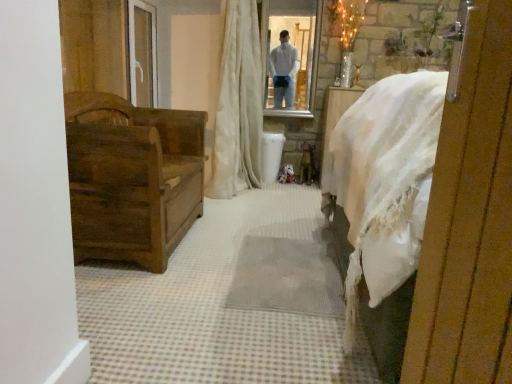
This screenshot has height=384, width=512. What do you see at coordinates (238, 105) in the screenshot?
I see `white textured curtain at center` at bounding box center [238, 105].

This screenshot has width=512, height=384. What are the coordinates of `dark brown wood chest at left` in the screenshot? It's located at (132, 178).

The width and height of the screenshot is (512, 384). Describe the element at coordinates (228, 302) in the screenshot. I see `wooden chest at left` at that location.

The height and width of the screenshot is (384, 512). Find the location of `white textured curtain at center`. white textured curtain at center is located at coordinates (238, 105).

Considering the relative sizes of white textured curtain at center and wooden chest at left in the image provided, is white textured curtain at center taller than wooden chest at left?

Yes.

From the image's perspective, relative to wooden chest at left, is white textured curtain at center above or below?

Clearly, from the image's perspective, white textured curtain at center is above wooden chest at left.

Visually, is white textured curtain at center positioned to the left or to the right of wooden chest at left?

From the image, it's evident that white textured curtain at center is to the right of wooden chest at left.

Could you tell me if white textured curtain at center is turned towards wooden chest at left?

No, white textured curtain at center is not facing towards wooden chest at left.

Which object is positioned more to the left, wooden chest at left or white textured curtain at center?

wooden chest at left is more to the left.

Are wooden chest at left and white textured curtain at center located far from each other?

That's right, there is a large distance between wooden chest at left and white textured curtain at center.

Between point (156, 371) and point (223, 100), which one is positioned in front?

The point (156, 371) is in front.

From a real-world perspective, is wooden chest at left on white textured curtain at center?

No, from a real-world perspective, wooden chest at left is not above white textured curtain at center.

How different are the orientations of clear glass mirror at upper center and wooden chest at left in degrees?

The angle between the facing direction of clear glass mirror at upper center and the facing direction of wooden chest at left is 91.7 degrees.

Measure the distance from clear glass mirror at upper center to wooden chest at left.

clear glass mirror at upper center is 7.01 feet away from wooden chest at left.

Find the location of a particular element. plain beneath the clear glass mirror at upper center (from a real-world perspective) is located at coordinates (228, 302).

Between clear glass mirror at upper center and wooden chest at left, which one has larger width?

Wider between the two is wooden chest at left.

What are the coordinates of `mirror lying above the white textured curtain at center (from the image's perspective)` in the screenshot? It's located at (292, 55).

From the image's perspective, is clear glass mirror at upper center on top of white textured curtain at center?

Yes, from the image's perspective, clear glass mirror at upper center is over white textured curtain at center.

From their relative heights in the image, would you say clear glass mirror at upper center is taller or shorter than white textured curtain at center?

In the image, clear glass mirror at upper center appears to be shorter than white textured curtain at center.

At what (x,y) coordinates should I click in order to perform the action: click on curtain located behind the dark brown wood chest at left. Please return your answer as a coordinate pair (x, y). The image size is (512, 384). Looking at the image, I should click on (238, 105).

Is white textured curtain at center oriented towards dark brown wood chest at left?

No, white textured curtain at center is not oriented towards dark brown wood chest at left.

From the image's perspective, which one is positioned higher, white textured curtain at center or dark brown wood chest at left?

white textured curtain at center is shown above in the image.

Looking at their sizes, would you say dark brown wood chest at left is wider or thinner than white textured curtain at center?

Clearly, dark brown wood chest at left has more width compared to white textured curtain at center.

How different are the orientations of dark brown wood chest at left and white textured curtain at center in degrees?

They differ by 2.26 degrees in their facing directions.

Is the surface of dark brown wood chest at left in direct contact with white textured curtain at center?

No, dark brown wood chest at left is not next to white textured curtain at center.

Is dark brown wood chest at left inside or outside of white textured curtain at center?

dark brown wood chest at left is not inside white textured curtain at center, it's outside.

Which object is closer to the camera taking this photo, dark brown wood chest at left or wooden chest at left?

wooden chest at left is in front.

Considering the relative sizes of dark brown wood chest at left and wooden chest at left in the image provided, is dark brown wood chest at left bigger than wooden chest at left?

Correct, dark brown wood chest at left is larger in size than wooden chest at left.

Is dark brown wood chest at left wider or thinner than wooden chest at left?

Considering their sizes, dark brown wood chest at left looks slimmer than wooden chest at left.

Is dark brown wood chest at left positioned beyond the bounds of wooden chest at left?

Yes, dark brown wood chest at left is located beyond the bounds of wooden chest at left.

The image size is (512, 384). What are the coordinates of `curtain above the wooden chest at left (from the image's perspective)` in the screenshot? It's located at (x=238, y=105).

At what (x,y) coordinates should I click in order to perform the action: click on curtain to the right of wooden chest at left. Please return your answer as a coordinate pair (x, y). This screenshot has width=512, height=384. Looking at the image, I should click on (238, 105).

Estimate the real-world distances between objects in this image. Which object is closer to clear glass mirror at upper center, wooden chest at left or white textured curtain at center?

Based on the image, white textured curtain at center appears to be nearer to clear glass mirror at upper center.

Estimate the real-world distances between objects in this image. Which object is closer to dark brown wood chest at left, wooden chest at left or white textured curtain at center?

Among the two, wooden chest at left is located nearer to dark brown wood chest at left.

Looking at the image, which one is located further to dark brown wood chest at left, clear glass mirror at upper center or wooden chest at left?

The object further to dark brown wood chest at left is clear glass mirror at upper center.

Which object lies further to the anchor point white textured curtain at center, wooden chest at left or clear glass mirror at upper center?

wooden chest at left.

From the image, which object appears to be nearer to white textured curtain at center, dark brown wood chest at left or clear glass mirror at upper center?

clear glass mirror at upper center is closer to white textured curtain at center.

Considering their positions, is clear glass mirror at upper center positioned closer to wooden chest at left than dark brown wood chest at left?

Based on the image, dark brown wood chest at left appears to be nearer to wooden chest at left.

Estimate the real-world distances between objects in this image. Which object is closer to clear glass mirror at upper center, dark brown wood chest at left or wooden chest at left?

The object closer to clear glass mirror at upper center is dark brown wood chest at left.

Considering their positions, is dark brown wood chest at left positioned further to white textured curtain at center than wooden chest at left?

wooden chest at left lies further to white textured curtain at center than the other object.

Find the location of a particular element. furniture located between wooden chest at left and white textured curtain at center in the depth direction is located at coordinates (132, 178).

Find the location of a particular element. furniture located between wooden chest at left and clear glass mirror at upper center in the depth direction is located at coordinates (132, 178).

The height and width of the screenshot is (384, 512). I want to click on curtain positioned between dark brown wood chest at left and clear glass mirror at upper center from near to far, so [238, 105].

Locate an element on the screen. curtain between wooden chest at left and clear glass mirror at upper center from front to back is located at coordinates (238, 105).